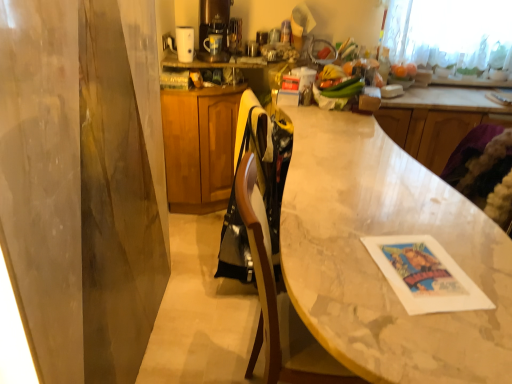
Locate an element on the screen. free space above marble at center (from a real-world perspective) is located at coordinates (360, 168).